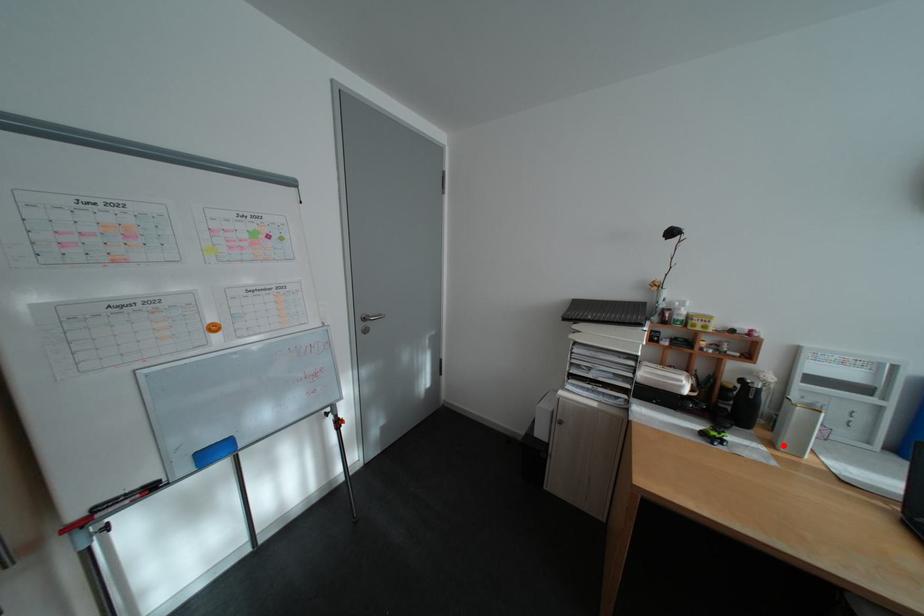
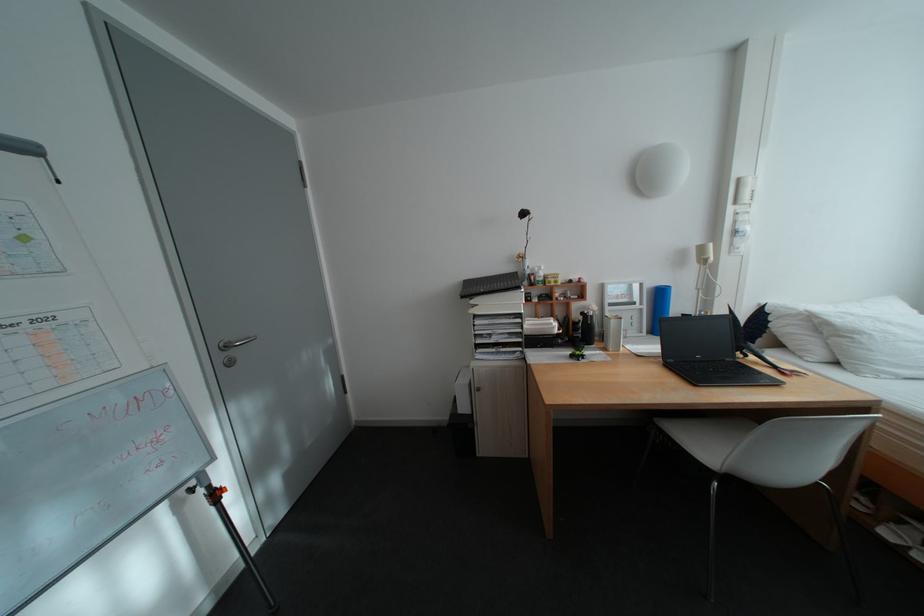
Where in the second image is the point corresponding to the highlighted location from the first image?

(617, 350)